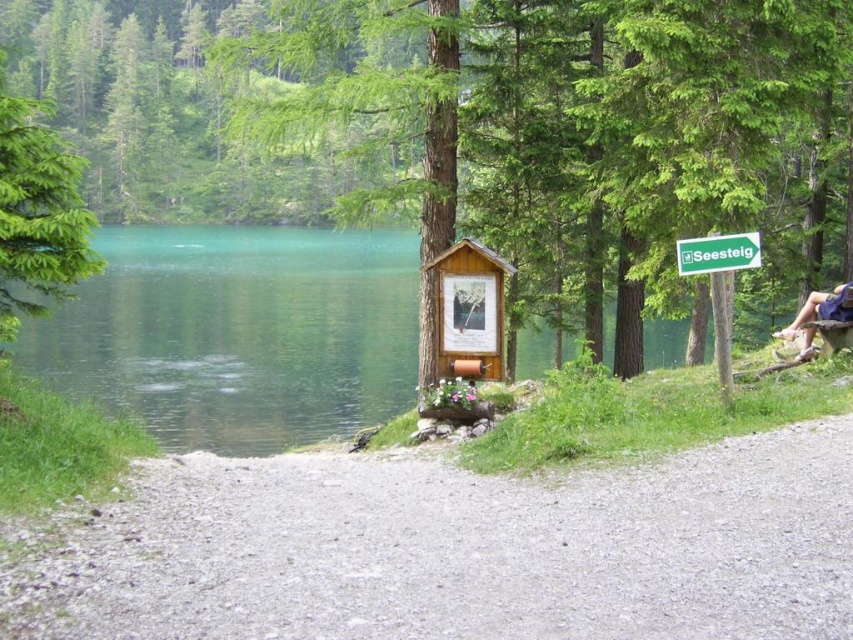
Between green plastic sign at upper right and brown wooden bench at right, which one is positioned lower?

Positioned lower is brown wooden bench at right.

Is green plastic sign at upper right shorter than brown wooden bench at right?

Indeed, green plastic sign at upper right has a lesser height compared to brown wooden bench at right.

Is point (724, 250) more distant than point (846, 321)?

No, it is in front of (846, 321).

The height and width of the screenshot is (640, 853). I want to click on green plastic sign at upper right, so click(718, 253).

Who is shorter, green matte tree at upper left or green plastic sign at upper right?

Standing shorter between the two is green plastic sign at upper right.

Which is above, green matte tree at upper left or green plastic sign at upper right?

Positioned higher is green matte tree at upper left.

Locate an element on the screen. The width and height of the screenshot is (853, 640). green matte tree at upper left is located at coordinates (38, 212).

This screenshot has height=640, width=853. Describe the element at coordinates (469, 310) in the screenshot. I see `wooden sign at center` at that location.

What do you see at coordinates (469, 310) in the screenshot? Image resolution: width=853 pixels, height=640 pixels. I see `wooden sign at center` at bounding box center [469, 310].

At what (x,y) coordinates should I click in order to perform the action: click on wooden sign at center. Please return your answer as a coordinate pair (x, y). Image resolution: width=853 pixels, height=640 pixels. Looking at the image, I should click on (469, 310).